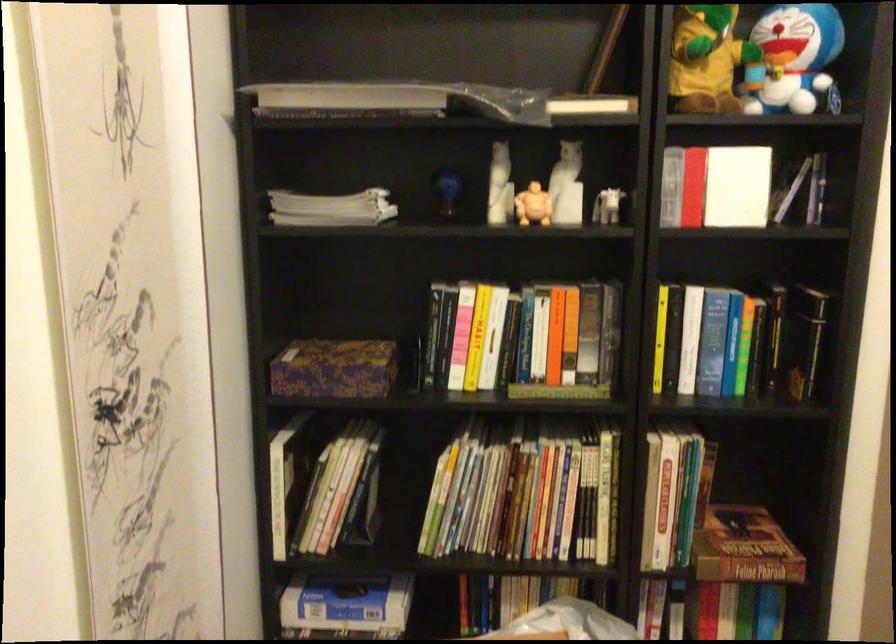
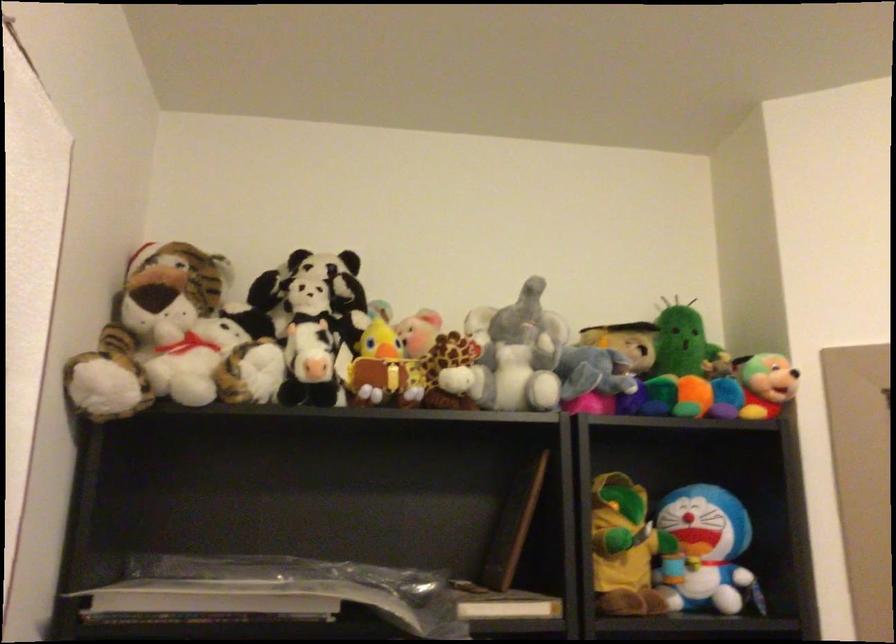
Question: The images are taken continuously from a first-person perspective. In which direction is your viewpoint rotating?

Choices:
 (A) Left
 (B) Right
 (C) Up
 (D) Down

Answer: (C)